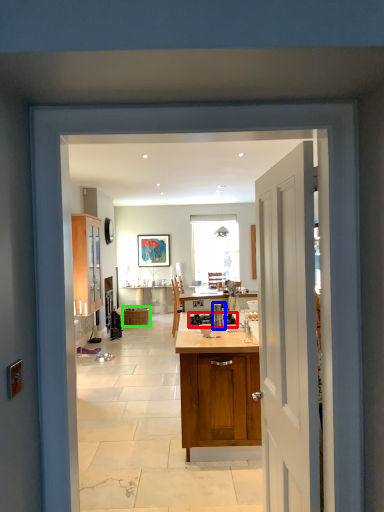
Question: Which object is the closest to the appliance (highlighted by a red box)? Choose among these: kitchen appliance (highlighted by a blue box) or cabinetry (highlighted by a green box).

Choices:
 (A) kitchen appliance
 (B) cabinetry

Answer: (A)